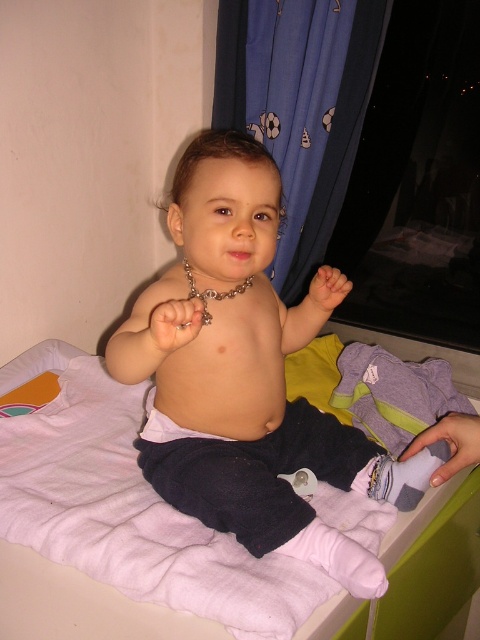
You are a parent trying to dress your baby. You have a nude fabric baby at center and a purple soft cloth at center on the changing table. Which item takes up more space on the table?

The nude fabric baby at center is larger in size than the purple soft cloth at center, so it takes up more space on the table.

Looking at this image, you are a parent trying to organize items on the changing table. You have two points marked on the table surface. The first point is at coordinates point (265, 177), and the second is at point (328, 616). Which point is closer to the baby?

Point (265, 177) is behind point (328, 616), so the second point is closer to the baby.

You are a parent trying to place a new toy on the changing table. The toy requires a specific placement at coordinates point (247, 376). However, there are items already on the table. Can you place the toy at that exact point without moving any existing items?

The point (247, 376) corresponds to the nude fabric baby at center, so you cannot place the toy there without moving the baby.